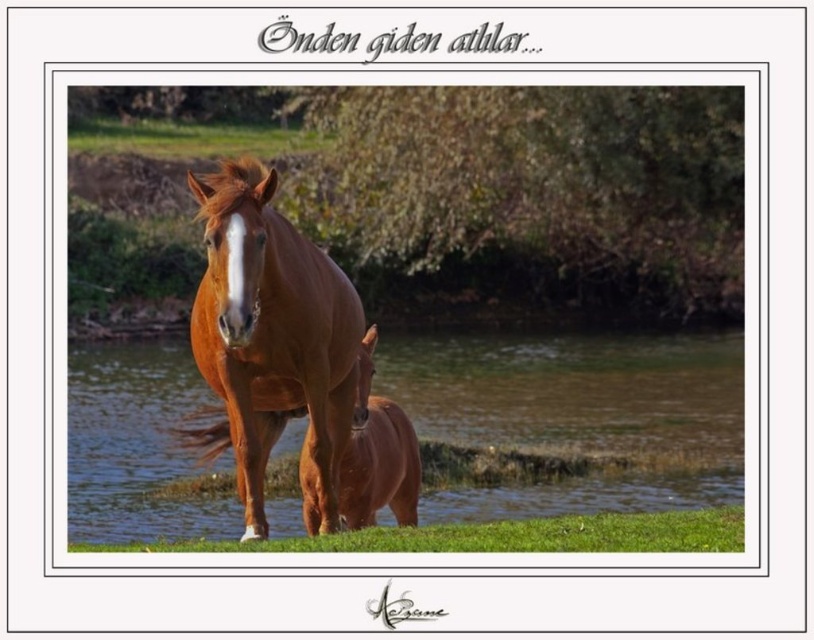
Who is positioned more to the right, brown glossy water at center or brown glossy horse at center?

brown glossy water at center

Between point (576, 461) and point (272, 256), which one is positioned behind?

Positioned behind is point (576, 461).

Which is behind, point (125, 353) or point (274, 262)?

The point (125, 353) is behind.

I want to click on brown glossy water at center, so click(570, 420).